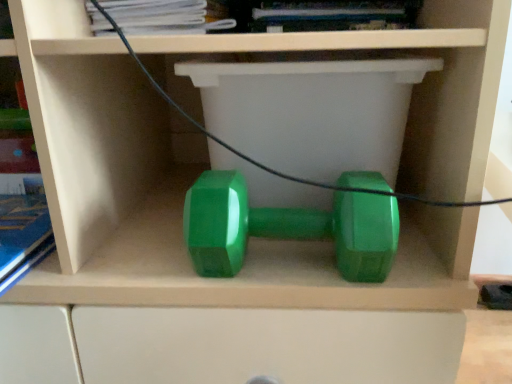
I want to click on green plastic dumbbell at center, so click(x=287, y=228).

What do you see at coordinates (287, 228) in the screenshot? This screenshot has height=384, width=512. I see `green plastic dumbbell at center` at bounding box center [287, 228].

Measure the distance between green plastic dumbbell at center and camera.

A distance of 16.45 inches exists between green plastic dumbbell at center and camera.

Where is `green plastic dumbbell at center`? This screenshot has width=512, height=384. green plastic dumbbell at center is located at coordinates (287, 228).